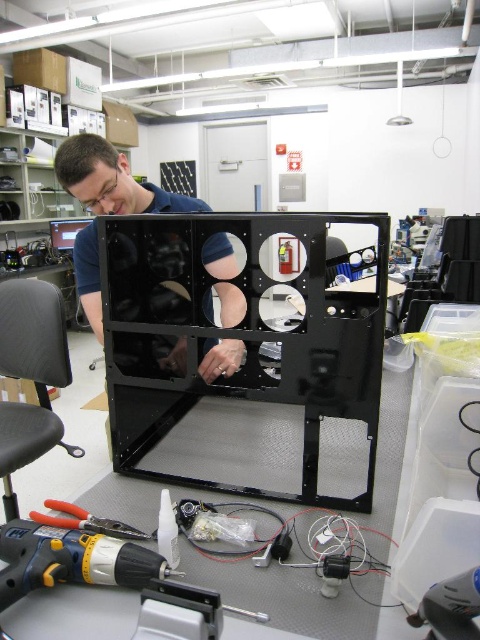
Question: Which point is closer to the camera?

Choices:
 (A) yellow plastic drill at lower left
 (B) yellow plastic pliers at lower left

Answer: (A)

Question: Which is farther from the matte black shirt at center?

Choices:
 (A) yellow plastic drill at lower left
 (B) yellow plastic pliers at lower left

Answer: (B)

Question: Can you confirm if yellow plastic drill at lower left is positioned to the left of yellow plastic pliers at lower left?

Choices:
 (A) yes
 (B) no

Answer: (B)

Question: Does matte black shirt at center have a larger size compared to yellow plastic pliers at lower left?

Choices:
 (A) yes
 (B) no

Answer: (A)

Question: Which of the following is the closest to the observer?

Choices:
 (A) (107, 164)
 (B) (27, 548)
 (C) (137, 538)

Answer: (B)

Question: Considering the relative positions of matte black shirt at center and yellow plastic pliers at lower left in the image provided, where is matte black shirt at center located with respect to yellow plastic pliers at lower left?

Choices:
 (A) left
 (B) right

Answer: (B)